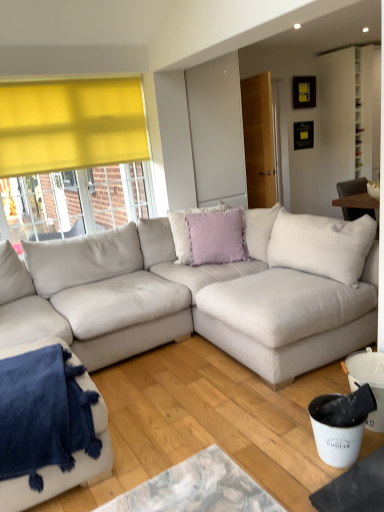
The image size is (384, 512). What do you see at coordinates (62, 472) in the screenshot? I see `velvety blue blanket at lower left, which ranks as the 1th studio couch in left-to-right order` at bounding box center [62, 472].

This screenshot has width=384, height=512. I want to click on lavender velvet cushion at center, the second pillow positioned from the back, so click(217, 237).

Measure the distance between lavender velvet pillow at center, marked as the 1th pillow in a back-to-front arrangement, and camera.

The distance of lavender velvet pillow at center, marked as the 1th pillow in a back-to-front arrangement, from camera is 11.48 feet.

What is the approximate height of lavender velvet pillow at center, marked as the 1th pillow in a back-to-front arrangement?

22.75 inches.

The width and height of the screenshot is (384, 512). Find the location of `suede-like beige couch at center, the second studio couch from the left`. suede-like beige couch at center, the second studio couch from the left is located at coordinates (195, 306).

Is suede-like beige couch at center, the second studio couch from the left, oriented towards lavender velvet cushion at center, the second pillow positioned from the back?

No, suede-like beige couch at center, the second studio couch from the left, is not turned towards lavender velvet cushion at center, the second pillow positioned from the back.

From the image's perspective, is suede-like beige couch at center, acting as the first studio couch starting from the right, on lavender velvet cushion at center, the first pillow in the front-to-back sequence?

No, from the image's perspective, suede-like beige couch at center, acting as the first studio couch starting from the right, is not above lavender velvet cushion at center, the first pillow in the front-to-back sequence.

Would you say suede-like beige couch at center, acting as the first studio couch starting from the right, is to the left or to the right of lavender velvet cushion at center, the second pillow positioned from the back, in the picture?

suede-like beige couch at center, acting as the first studio couch starting from the right, is to the left of lavender velvet cushion at center, the second pillow positioned from the back.

Is lavender velvet cushion at center, the first pillow in the front-to-back sequence, oriented away from velvety blue blanket at lower left, which is the 2th studio couch in right-to-left order?

No, lavender velvet cushion at center, the first pillow in the front-to-back sequence,'s orientation is not away from velvety blue blanket at lower left, which is the 2th studio couch in right-to-left order.

Which point is more distant from viewer, [235,251] or [77,469]?

The point [235,251] is behind.

Does lavender velvet cushion at center, the first pillow in the front-to-back sequence, have a greater width compared to velvety blue blanket at lower left, which ranks as the 1th studio couch in left-to-right order?

Incorrect, the width of lavender velvet cushion at center, the first pillow in the front-to-back sequence, does not surpass that of velvety blue blanket at lower left, which ranks as the 1th studio couch in left-to-right order.

Is lavender velvet cushion at center, the second pillow positioned from the back, positioned far away from velvety blue blanket at lower left, which is the 2th studio couch in right-to-left order?

Yes, lavender velvet cushion at center, the second pillow positioned from the back, and velvety blue blanket at lower left, which is the 2th studio couch in right-to-left order, are quite far apart.

Does point (144, 221) come farther from viewer compared to point (178, 262)?

That is True.

Is suede-like beige couch at center, acting as the first studio couch starting from the right, outside of lavender velvet pillow at center, which ranks as the second pillow in front-to-back order?

Absolutely, suede-like beige couch at center, acting as the first studio couch starting from the right, is external to lavender velvet pillow at center, which ranks as the second pillow in front-to-back order.

Consider the image. In terms of size, does suede-like beige couch at center, the second studio couch from the left, appear bigger or smaller than lavender velvet pillow at center, marked as the 1th pillow in a back-to-front arrangement?

Clearly, suede-like beige couch at center, the second studio couch from the left, is larger in size than lavender velvet pillow at center, marked as the 1th pillow in a back-to-front arrangement.

Consider the image. From a real-world perspective, does suede-like beige couch at center, the second studio couch from the left, stand above lavender velvet pillow at center, which ranks as the second pillow in front-to-back order?

No, from a real-world perspective, suede-like beige couch at center, the second studio couch from the left, is not above lavender velvet pillow at center, which ranks as the second pillow in front-to-back order.

Considering the positions of points (176, 236) and (40, 471), is point (176, 236) closer to camera compared to point (40, 471)?

No, (176, 236) is further to viewer.

From the picture: Does lavender velvet pillow at center, marked as the 1th pillow in a back-to-front arrangement, have a greater width compared to velvety blue blanket at lower left, which ranks as the 1th studio couch in left-to-right order?

No.

From the image's perspective, which one is positioned higher, lavender velvet pillow at center, marked as the 1th pillow in a back-to-front arrangement, or velvety blue blanket at lower left, which is the 2th studio couch in right-to-left order?

lavender velvet pillow at center, marked as the 1th pillow in a back-to-front arrangement, is shown above in the image.

Considering the positions of objects lavender velvet pillow at center, marked as the 1th pillow in a back-to-front arrangement, and velvety blue blanket at lower left, which is the 2th studio couch in right-to-left order, in the image provided, who is more to the left, lavender velvet pillow at center, marked as the 1th pillow in a back-to-front arrangement, or velvety blue blanket at lower left, which is the 2th studio couch in right-to-left order,?

From the viewer's perspective, velvety blue blanket at lower left, which is the 2th studio couch in right-to-left order, appears more on the left side.

Considering the sizes of lavender velvet cushion at center, the first pillow in the front-to-back sequence, and lavender velvet pillow at center, which ranks as the second pillow in front-to-back order, in the image, is lavender velvet cushion at center, the first pillow in the front-to-back sequence, wider or thinner than lavender velvet pillow at center, which ranks as the second pillow in front-to-back order,?

Clearly, lavender velvet cushion at center, the first pillow in the front-to-back sequence, has less width compared to lavender velvet pillow at center, which ranks as the second pillow in front-to-back order.

Is lavender velvet cushion at center, the first pillow in the front-to-back sequence, smaller than lavender velvet pillow at center, marked as the 1th pillow in a back-to-front arrangement?

Indeed, lavender velvet cushion at center, the first pillow in the front-to-back sequence, has a smaller size compared to lavender velvet pillow at center, marked as the 1th pillow in a back-to-front arrangement.

Is lavender velvet cushion at center, the first pillow in the front-to-back sequence, far from lavender velvet pillow at center, which ranks as the second pillow in front-to-back order?

No.

Is lavender velvet cushion at center, the first pillow in the front-to-back sequence, oriented away from lavender velvet pillow at center, which ranks as the second pillow in front-to-back order?

Yes, lavender velvet cushion at center, the first pillow in the front-to-back sequence, is facing away from lavender velvet pillow at center, which ranks as the second pillow in front-to-back order.

In terms of height, does suede-like beige couch at center, acting as the first studio couch starting from the right, look taller or shorter compared to velvety blue blanket at lower left, which is the 2th studio couch in right-to-left order?

Considering their sizes, suede-like beige couch at center, acting as the first studio couch starting from the right, has more height than velvety blue blanket at lower left, which is the 2th studio couch in right-to-left order.

Is the position of suede-like beige couch at center, the second studio couch from the left, less distant than that of velvety blue blanket at lower left, which is the 2th studio couch in right-to-left order?

Yes, suede-like beige couch at center, the second studio couch from the left, is closer to the viewer.

Would you say suede-like beige couch at center, acting as the first studio couch starting from the right, is a long distance from velvety blue blanket at lower left, which is the 2th studio couch in right-to-left order?

No, there isn't a large distance between suede-like beige couch at center, acting as the first studio couch starting from the right, and velvety blue blanket at lower left, which is the 2th studio couch in right-to-left order.

Is point (147, 336) positioned behind point (76, 461)?

Yes, it is.

In the scene shown: Visually, is lavender velvet pillow at center, which ranks as the second pillow in front-to-back order, positioned to the left or to the right of lavender velvet cushion at center, the second pillow positioned from the back?

Based on their positions, lavender velvet pillow at center, which ranks as the second pillow in front-to-back order, is located to the left of lavender velvet cushion at center, the second pillow positioned from the back.

From the image's perspective, is lavender velvet pillow at center, marked as the 1th pillow in a back-to-front arrangement, on lavender velvet cushion at center, the second pillow positioned from the back?

Indeed, from the image's perspective, lavender velvet pillow at center, marked as the 1th pillow in a back-to-front arrangement, is shown above lavender velvet cushion at center, the second pillow positioned from the back.

Between point (190, 260) and point (195, 223), which one is positioned in front?

The point (195, 223) is closer.

I want to click on the 2nd pillow counting from the right of the suede-like beige couch at center, the second studio couch from the left, so click(x=217, y=237).

Locate an element on the screen. the 1st studio couch in front of the lavender velvet cushion at center, the first pillow in the front-to-back sequence, starting your count from the anchor is located at coordinates (62, 472).

Based on their spatial positions, is suede-like beige couch at center, acting as the first studio couch starting from the right, or lavender velvet pillow at center, which ranks as the second pillow in front-to-back order, further from lavender velvet cushion at center, the second pillow positioned from the back?

suede-like beige couch at center, acting as the first studio couch starting from the right, is positioned further to the anchor lavender velvet cushion at center, the second pillow positioned from the back.

Estimate the real-world distances between objects in this image. Which object is closer to suede-like beige couch at center, acting as the first studio couch starting from the right, lavender velvet pillow at center, marked as the 1th pillow in a back-to-front arrangement, or velvety blue blanket at lower left, which ranks as the 1th studio couch in left-to-right order?

A: lavender velvet pillow at center, marked as the 1th pillow in a back-to-front arrangement, lies closer to suede-like beige couch at center, acting as the first studio couch starting from the right, than the other object.

Estimate the real-world distances between objects in this image. Which object is further from lavender velvet pillow at center, which ranks as the second pillow in front-to-back order, lavender velvet cushion at center, the second pillow positioned from the back, or velvety blue blanket at lower left, which ranks as the 1th studio couch in left-to-right order?

Based on the image, velvety blue blanket at lower left, which ranks as the 1th studio couch in left-to-right order, appears to be further to lavender velvet pillow at center, which ranks as the second pillow in front-to-back order.

Which object lies further to the anchor point lavender velvet cushion at center, the second pillow positioned from the back, suede-like beige couch at center, the second studio couch from the left, or velvety blue blanket at lower left, which is the 2th studio couch in right-to-left order?

The object further to lavender velvet cushion at center, the second pillow positioned from the back, is velvety blue blanket at lower left, which is the 2th studio couch in right-to-left order.

Based on their spatial positions, is lavender velvet pillow at center, marked as the 1th pillow in a back-to-front arrangement, or velvety blue blanket at lower left, which ranks as the 1th studio couch in left-to-right order, further from lavender velvet cushion at center, the second pillow positioned from the back?

The object further to lavender velvet cushion at center, the second pillow positioned from the back, is velvety blue blanket at lower left, which ranks as the 1th studio couch in left-to-right order.

Looking at the image, which one is located further to velvety blue blanket at lower left, which is the 2th studio couch in right-to-left order, suede-like beige couch at center, acting as the first studio couch starting from the right, or lavender velvet pillow at center, marked as the 1th pillow in a back-to-front arrangement?

lavender velvet pillow at center, marked as the 1th pillow in a back-to-front arrangement, is further to velvety blue blanket at lower left, which is the 2th studio couch in right-to-left order.

Considering their positions, is suede-like beige couch at center, the second studio couch from the left, positioned further to lavender velvet pillow at center, which ranks as the second pillow in front-to-back order, than lavender velvet cushion at center, the second pillow positioned from the back?

suede-like beige couch at center, the second studio couch from the left, is positioned further to the anchor lavender velvet pillow at center, which ranks as the second pillow in front-to-back order.

Looking at the image, which one is located further to velvety blue blanket at lower left, which ranks as the 1th studio couch in left-to-right order, lavender velvet cushion at center, the second pillow positioned from the back, or lavender velvet pillow at center, which ranks as the second pillow in front-to-back order?

The object further to velvety blue blanket at lower left, which ranks as the 1th studio couch in left-to-right order, is lavender velvet pillow at center, which ranks as the second pillow in front-to-back order.

Locate an element on the screen. pillow positioned between suede-like beige couch at center, acting as the first studio couch starting from the right, and lavender velvet pillow at center, which ranks as the second pillow in front-to-back order, from near to far is located at coordinates (217, 237).

The width and height of the screenshot is (384, 512). What are the coordinates of `studio couch positioned between suede-like beige couch at center, acting as the first studio couch starting from the right, and lavender velvet pillow at center, marked as the 1th pillow in a back-to-front arrangement, from near to far` in the screenshot? It's located at (62, 472).

The height and width of the screenshot is (512, 384). In order to click on studio couch between suede-like beige couch at center, the second studio couch from the left, and lavender velvet cushion at center, the second pillow positioned from the back, in the front-back direction in this screenshot , I will do `click(62, 472)`.

Find the location of `pillow located between velvety blue blanket at lower left, which is the 2th studio couch in right-to-left order, and lavender velvet pillow at center, marked as the 1th pillow in a back-to-front arrangement, in the depth direction`. pillow located between velvety blue blanket at lower left, which is the 2th studio couch in right-to-left order, and lavender velvet pillow at center, marked as the 1th pillow in a back-to-front arrangement, in the depth direction is located at coordinates (217, 237).